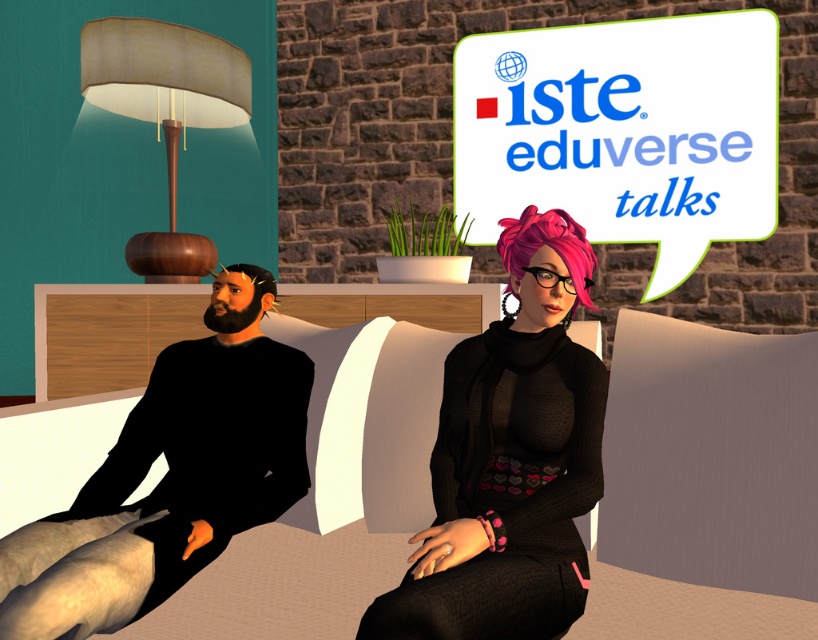
You are an event organizer setting up a photo booth for the ISTE EduVerse Talks. You need to ensure that the distance between the shiny pink hair at center and the matte brown lampshade at upper left is at least 3 meters for proper lighting. Based on the scene description, does the current setup meet this requirement?

The shiny pink hair at center is 3.09 meters from the matte brown lampshade at upper left, so the current setup meets the requirement as it exceeds the minimum 3 meters distance.

You are an interior designer planning to place a 7.5 feet long sofa between the black matte clothing at left and the matte brown lampshade at upper left. Will there be enough space for the sofa?

The distance between the black matte clothing at left and the matte brown lampshade at upper left is 8.00 feet. Since the sofa is 7.5 feet long, there is enough space to place it between them.